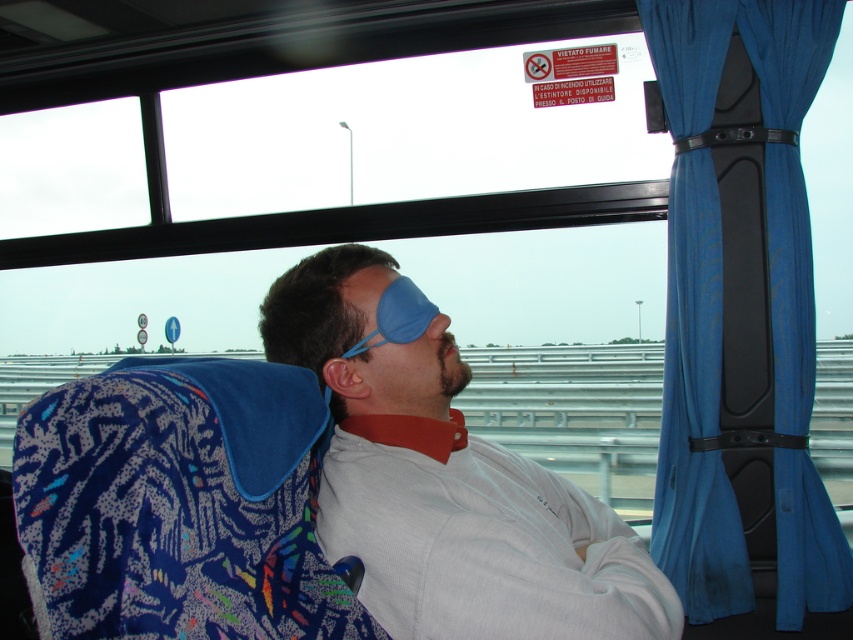
Question: Can you confirm if blue matte eye mask at center is smaller than blue matte eye mask at upper center?

Choices:
 (A) yes
 (B) no

Answer: (B)

Question: Does blue matte eye mask at center appear over blue matte eye mask at upper center?

Choices:
 (A) no
 (B) yes

Answer: (A)

Question: Is blue fabric curtain at right below blue matte eye mask at upper center?

Choices:
 (A) no
 (B) yes

Answer: (A)

Question: Among these objects, which one is nearest to the camera?

Choices:
 (A) blue fabric curtain at right
 (B) blue matte eye mask at upper center

Answer: (B)

Question: Which of the following is the closest to the observer?

Choices:
 (A) (776, 51)
 (B) (415, 285)

Answer: (B)

Question: Which of the following is the closest to the observer?

Choices:
 (A) (334, 355)
 (B) (399, 282)
 (C) (689, 259)

Answer: (A)